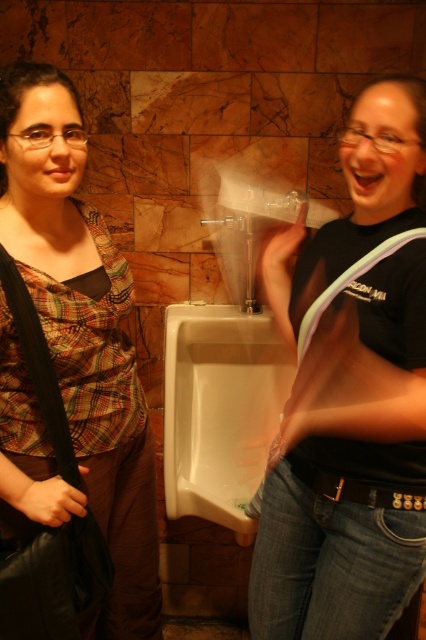
You are a photographer setting up a shoot in this restroom scene. You need to position a light source so that it illuminates both the plaid fabric shirt at left and the white glossy urinal at center equally. Considering their sizes, which object requires a closer light placement to achieve proper illumination?

The plaid fabric shirt at left is much taller than the white glossy urinal at center, so the light source should be placed closer to the white glossy urinal at center to ensure both receive equal illumination.

You are standing in a restroom and see the black matte shirt at center and the plaid fabric shirt at left. Which shirt is nearer to you?

The black matte shirt at center is closer to the viewer than the plaid fabric shirt at left.